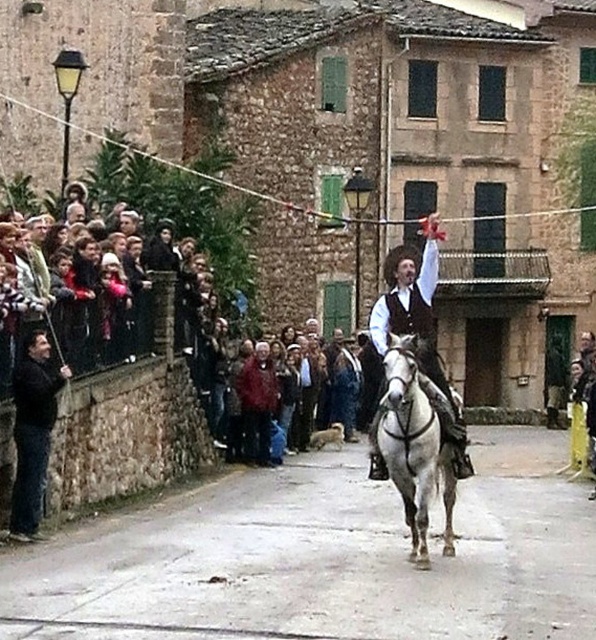
Question: Among these points, which one is farthest from the camera?

Choices:
 (A) (97, 342)
 (B) (390, 392)
 (C) (436, 218)

Answer: (C)

Question: Among these objects, which one is nearest to the camera?

Choices:
 (A) white glossy horse at center
 (B) red wool sweater at center
 (C) black leather jacket at left
 (D) dark clothing crowd at left

Answer: (A)

Question: Can you confirm if dark clothing crowd at left is positioned above red wool sweater at center?

Choices:
 (A) no
 (B) yes

Answer: (B)

Question: Is dark clothing crowd at left positioned in front of black leather jacket at left?

Choices:
 (A) no
 (B) yes

Answer: (A)

Question: Does black leather jacket at left appear under red wool sweater at center?

Choices:
 (A) yes
 (B) no

Answer: (B)

Question: Which point appears farthest from the camera in this image?

Choices:
 (A) (426, 227)
 (B) (252, 454)

Answer: (B)